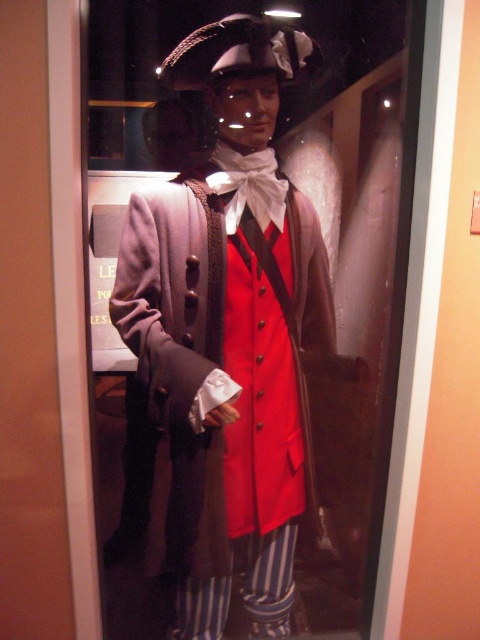
From the picture: Does matte brown coat at center have a greater height compared to white satin tie at center?

Yes.

Describe the element at coordinates (226, 340) in the screenshot. I see `matte brown coat at center` at that location.

Image resolution: width=480 pixels, height=640 pixels. I want to click on matte brown coat at center, so click(226, 340).

Locate an element on the screen. Image resolution: width=480 pixels, height=640 pixels. matte brown coat at center is located at coordinates (226, 340).